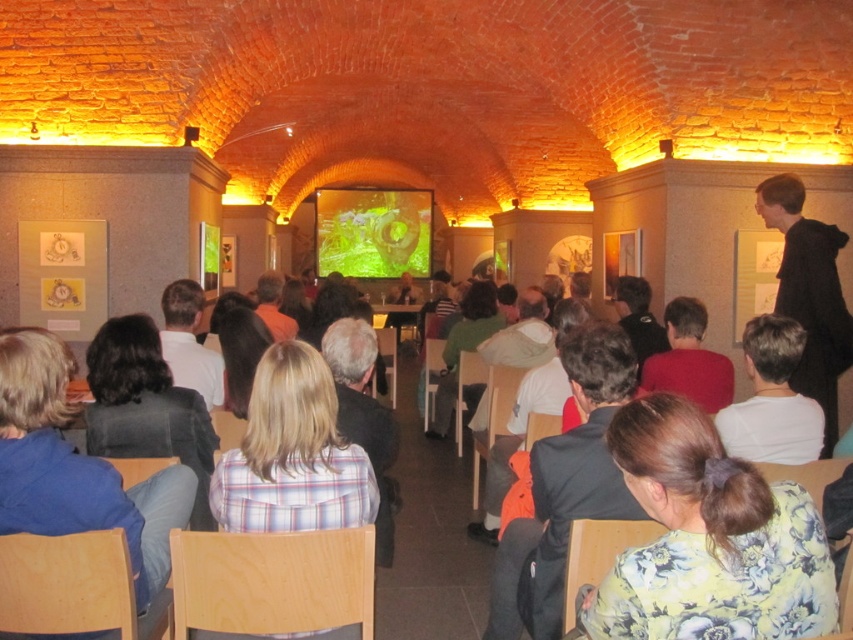
Question: Which object is farther from the camera taking this photo?

Choices:
 (A) light brown hair at center
 (B) black hoodie at right
 (C) blue fabric jacket at lower left
 (D) dark gray suit at center

Answer: (B)

Question: Is light brown hair at center below green fabric shirt at center?

Choices:
 (A) no
 (B) yes

Answer: (A)

Question: Which object is positioned farthest from the red matte shirt at center?

Choices:
 (A) dark brown hair at center
 (B) floral print shirt at lower right

Answer: (B)

Question: Which point is closer to the camera taking this photo?

Choices:
 (A) (157, 396)
 (B) (610, 388)
 (C) (755, 385)
 (D) (387, 273)

Answer: (B)

Question: In this image, where is green matte screen at center located relative to light brown hair at center?

Choices:
 (A) right
 (B) left

Answer: (B)

Question: Is dark brown leather jacket at lower left below green fabric shirt at center?

Choices:
 (A) yes
 (B) no

Answer: (A)